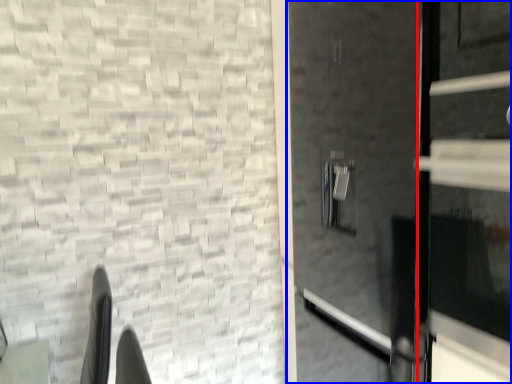
Question: Among these objects, which one is farthest to the camera, door (highlighted by a red box) or door (highlighted by a blue box)?

Choices:
 (A) door
 (B) door

Answer: (B)